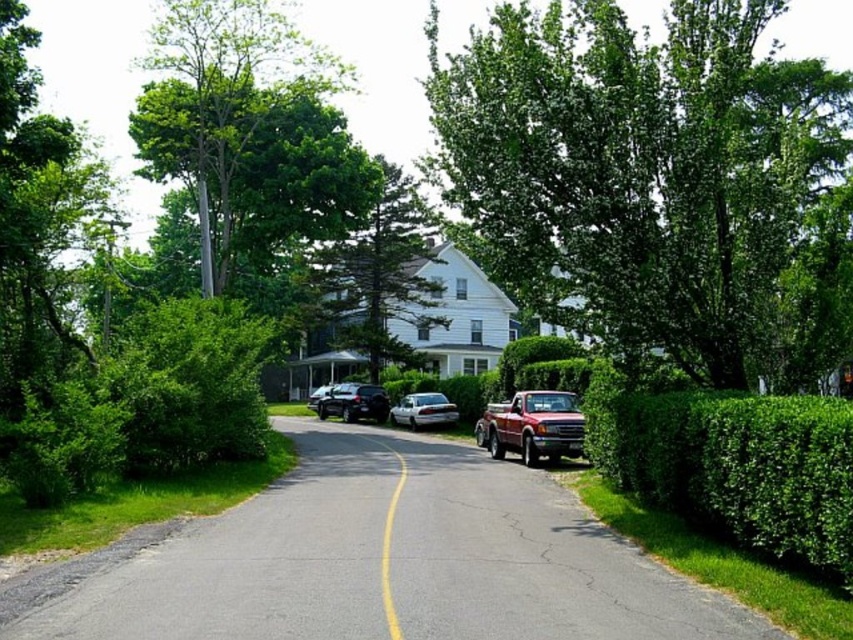
From the picture: Is metallic red truck at center to the left of shiny silver sedan at center from the viewer's perspective?

No, metallic red truck at center is not to the left of shiny silver sedan at center.

Which is in front, point (480, 433) or point (325, 392)?

Positioned in front is point (480, 433).

Image resolution: width=853 pixels, height=640 pixels. Find the location of `metallic red truck at center`. metallic red truck at center is located at coordinates pos(532,426).

Between satin black suv at center and shiny silver sedan at center, which one has less height?

satin black suv at center

Does satin black suv at center have a larger size compared to shiny silver sedan at center?

No.

Describe the element at coordinates (354, 403) in the screenshot. I see `satin black suv at center` at that location.

Locate an element on the screen. satin black suv at center is located at coordinates 354,403.

The width and height of the screenshot is (853, 640). What do you see at coordinates (248, 129) in the screenshot?
I see `green leafy tree at upper left` at bounding box center [248, 129].

Is green leafy tree at upper left smaller than satin black suv at center?

Actually, green leafy tree at upper left might be larger than satin black suv at center.

Who is more forward, (212, 140) or (334, 387)?

Point (212, 140) is more forward.

At what (x,y) coordinates should I click in order to perform the action: click on green leafy tree at upper left. Please return your answer as a coordinate pair (x, y). Looking at the image, I should click on (248, 129).